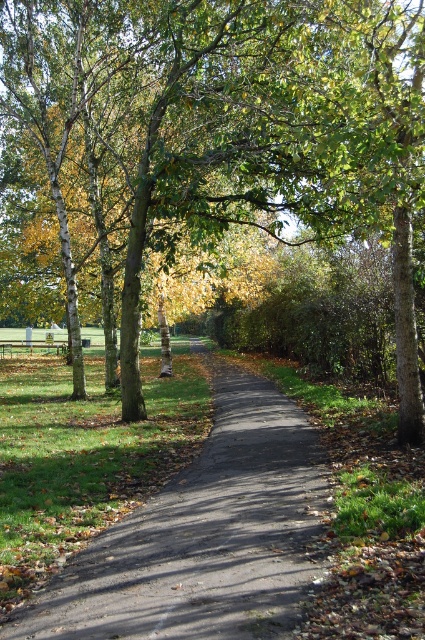
Question: Which point is closer to the camera?

Choices:
 (A) black asphalt path at center
 (B) wooden park bench at center

Answer: (A)

Question: Is the position of brown smooth tree at center less distant than that of black asphalt path at center?

Choices:
 (A) yes
 (B) no

Answer: (B)

Question: Among these objects, which one is farthest from the camera?

Choices:
 (A) brown smooth tree at center
 (B) black asphalt path at center

Answer: (A)

Question: Among these objects, which one is nearest to the camera?

Choices:
 (A) wooden park bench at center
 (B) black asphalt path at center
 (C) brown smooth tree at center

Answer: (B)

Question: Is black asphalt path at center smaller than wooden park bench at center?

Choices:
 (A) no
 (B) yes

Answer: (B)

Question: Is the position of black asphalt path at center less distant than that of wooden park bench at center?

Choices:
 (A) yes
 (B) no

Answer: (A)